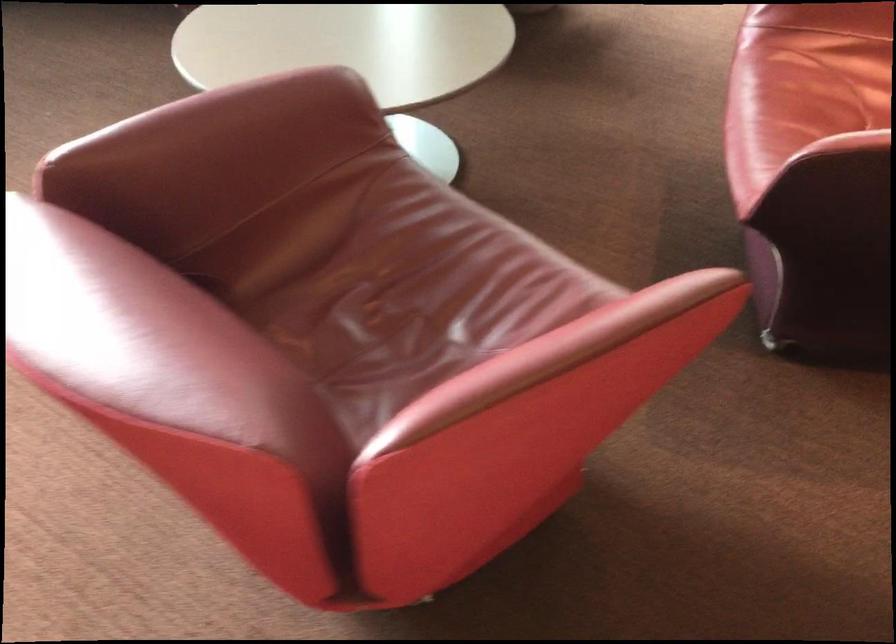
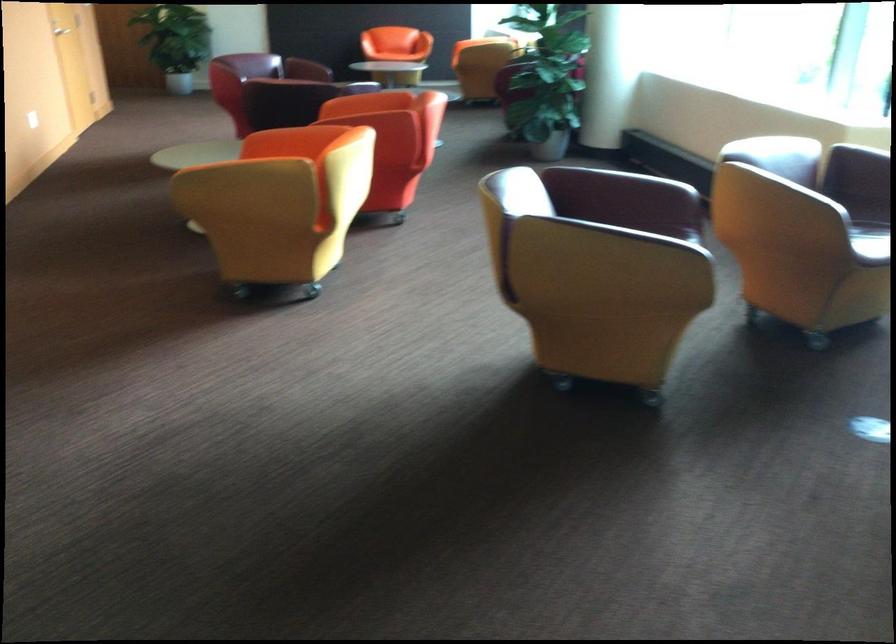
Question: I am providing you with two images of the same scene from different viewpoints. Please identify which objects are invisible in image2.

Choices:
 (A) yellow chair armrest
 (B) red chair armrest
 (C) red chair sitting surface
 (D) stuffed elephant toy

Answer: (C)